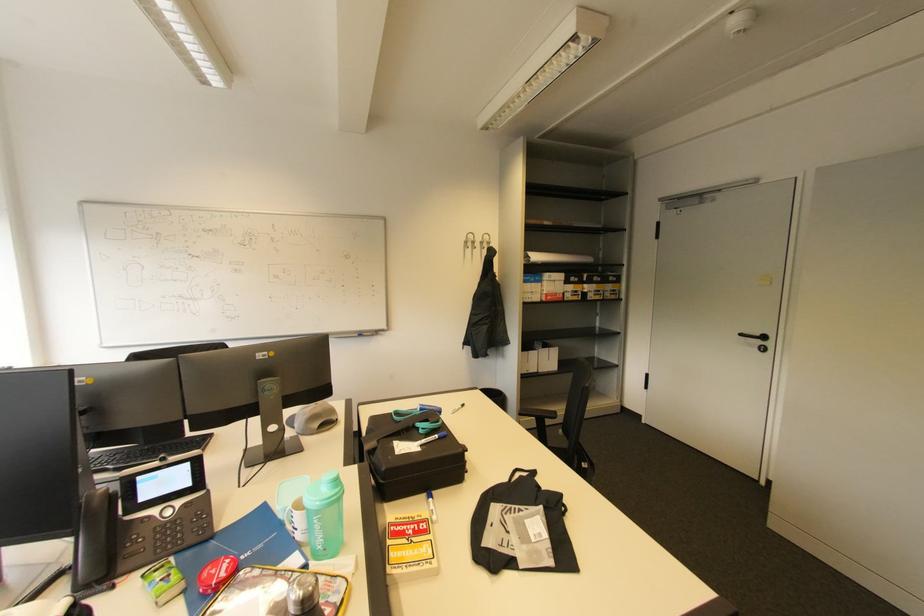
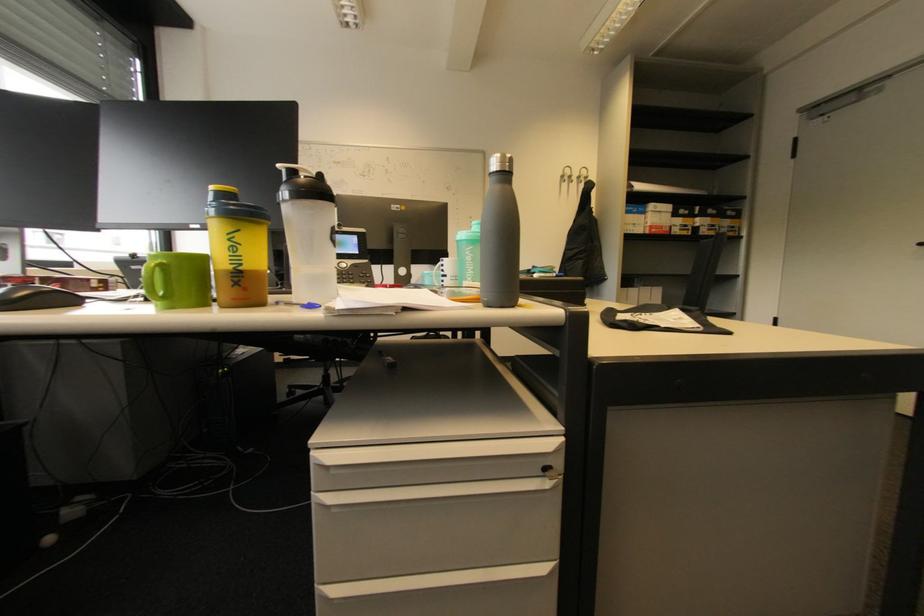
Locate, in the second image, the point that corresponds to point (320, 522) in the first image.

(472, 254)